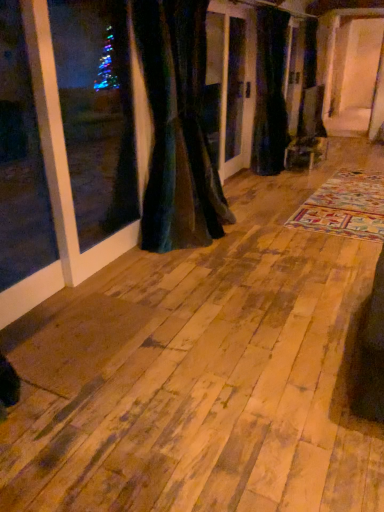
Question: Is velvet dark green curtain at center, the 2th curtain from the left, in front of or behind velvet dark green curtain at center, the first curtain positioned from the front, in the image?

Choices:
 (A) front
 (B) behind

Answer: (B)

Question: Which is correct: velvet dark green curtain at center, which is the 2th curtain in front-to-back order, is inside velvet dark green curtain at center, arranged as the 2th curtain when viewed from the back, or outside of it?

Choices:
 (A) inside
 (B) outside

Answer: (B)

Question: In the image, is velvet dark green curtain at center, the 1th curtain when ordered from right to left, on the left side or the right side of velvet dark green curtain at center, the 1th curtain viewed from the left?

Choices:
 (A) left
 (B) right

Answer: (B)

Question: Based on their sizes in the image, would you say velvet dark green curtain at center, the first curtain positioned from the front, is bigger or smaller than velvet dark green curtain at center, acting as the 1th curtain starting from the back?

Choices:
 (A) small
 (B) big

Answer: (B)

Question: Is velvet dark green curtain at center, the 1th curtain viewed from the left, in front of or behind velvet dark green curtain at center, which is the 2th curtain in front-to-back order, in the image?

Choices:
 (A) front
 (B) behind

Answer: (A)

Question: Considering the positions of point (205, 13) and point (266, 44), is point (205, 13) closer or farther from the camera than point (266, 44)?

Choices:
 (A) farther
 (B) closer

Answer: (B)

Question: Considering the relative positions of velvet dark green curtain at center, the 1th curtain viewed from the left, and velvet dark green curtain at center, acting as the 1th curtain starting from the back, in the image provided, is velvet dark green curtain at center, the 1th curtain viewed from the left, to the left or to the right of velvet dark green curtain at center, acting as the 1th curtain starting from the back,?

Choices:
 (A) left
 (B) right

Answer: (A)